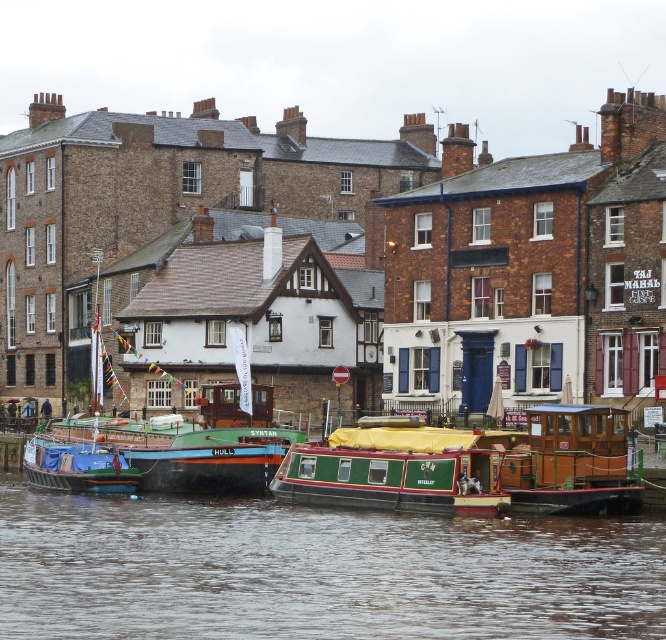
You are a delivery drone carrying a package that requires a minimum of 5 meters of clearance between two green boats to land safely. Given the distance between the green painted wooden boat at lower center and the green wooden boat at center, can you safely land your drone between them?

The green painted wooden boat at lower center and the green wooden boat at center are 6.28 meters apart from each other, which exceeds the required 5 meters clearance. Therefore, the drone can safely land between them.

You are standing at the riverside and want to place two markers at the coordinates point (462, 563) and point (440, 509). Which marker will be closer to your current position?

The marker at point (462, 563) will be closer to your current position because it is closer to the viewer than point (440, 509).

You are a tourist standing on the riverside and want to take a photo of both the green wooden boat at center and the wooden cabin cruiser at center. Which boat should you stand closer to in order to capture both in the same frame?

The green wooden boat at center is located above the wooden cabin cruiser at center, so you should stand closer to the wooden cabin cruiser at center to include both in the frame.